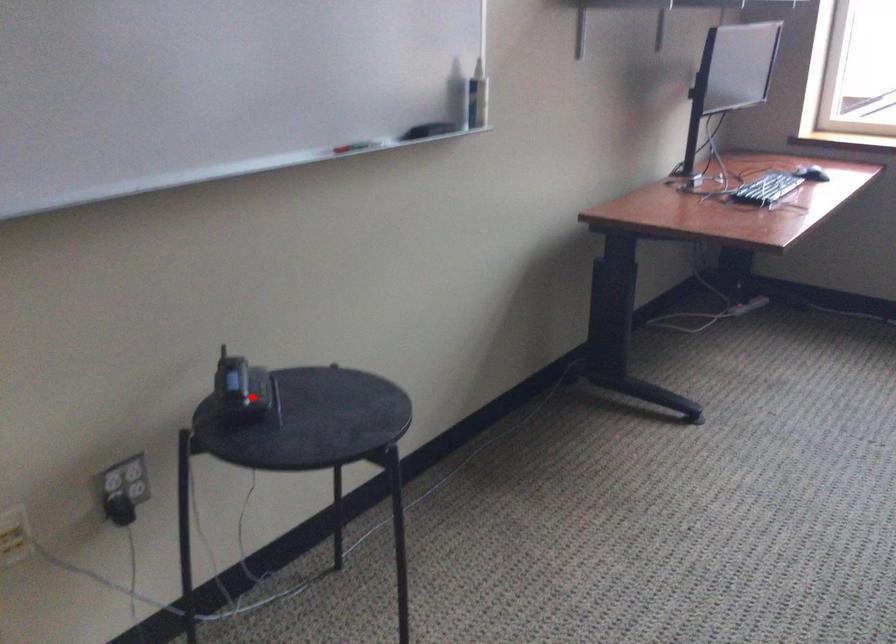
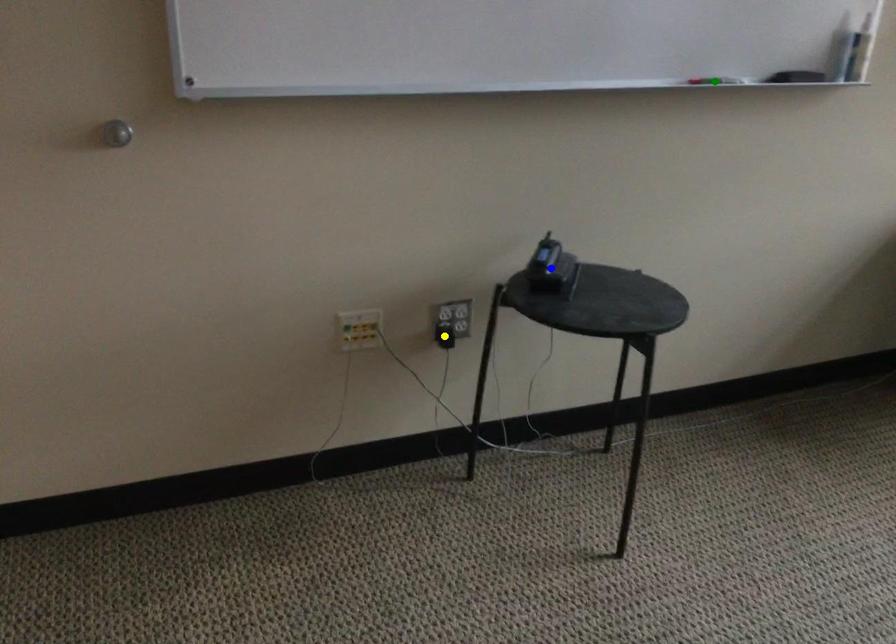
Question: I am providing you with two images of the same scene from different viewpoints. A red point is marked on the first image. You are given multiple points on the second image. Which mark in image 2 goes with the point in image 1?

Choices:
 (A) yellow point
 (B) green point
 (C) blue point

Answer: (C)